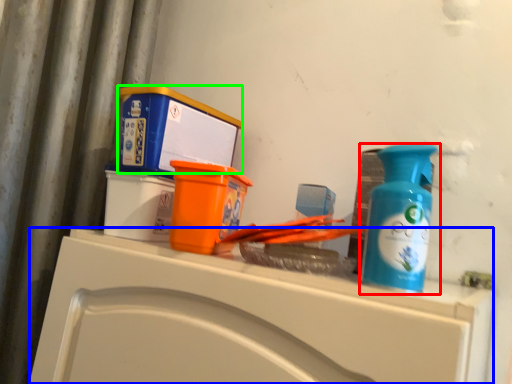
Question: Based on their relative distances, which object is farther from bottle (highlighted by a red box)? Choose from counter (highlighted by a blue box) and box (highlighted by a green box).

Choices:
 (A) counter
 (B) box

Answer: (B)